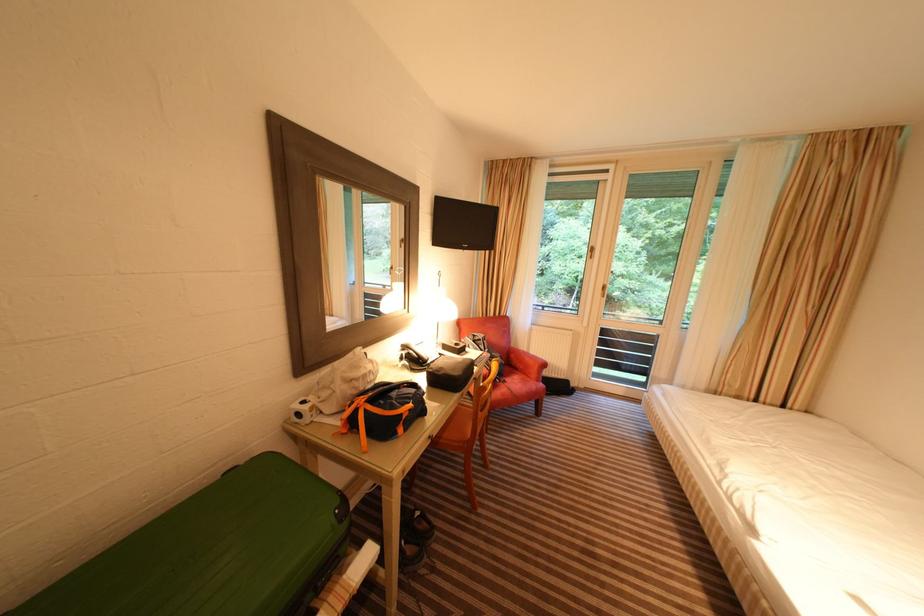
Where is `vertical door handle`? vertical door handle is located at coordinates (590, 252).